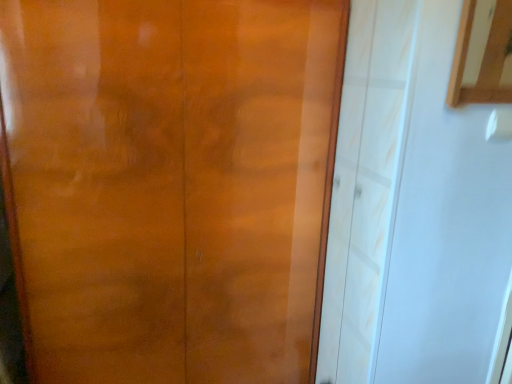
Question: Is matte wood door at center wider than light wood cabinet at upper right?

Choices:
 (A) yes
 (B) no

Answer: (A)

Question: Does matte wood door at center have a greater height compared to light wood cabinet at upper right?

Choices:
 (A) yes
 (B) no

Answer: (A)

Question: Is matte wood door at center oriented towards light wood cabinet at upper right?

Choices:
 (A) yes
 (B) no

Answer: (B)

Question: Are matte wood door at center and light wood cabinet at upper right far apart?

Choices:
 (A) no
 (B) yes

Answer: (B)

Question: Is light wood cabinet at upper right at the back of matte wood door at center?

Choices:
 (A) yes
 (B) no

Answer: (B)

Question: Can you confirm if matte wood door at center is smaller than light wood cabinet at upper right?

Choices:
 (A) yes
 (B) no

Answer: (B)

Question: Is light wood cabinet at upper right smaller than matte wood door at center?

Choices:
 (A) yes
 (B) no

Answer: (A)

Question: Does light wood cabinet at upper right have a greater height compared to matte wood door at center?

Choices:
 (A) no
 (B) yes

Answer: (A)

Question: Can you confirm if light wood cabinet at upper right is positioned to the right of matte wood door at center?

Choices:
 (A) yes
 (B) no

Answer: (A)

Question: Is light wood cabinet at upper right surrounding matte wood door at center?

Choices:
 (A) no
 (B) yes

Answer: (A)

Question: Can you confirm if light wood cabinet at upper right is thinner than matte wood door at center?

Choices:
 (A) yes
 (B) no

Answer: (A)

Question: From a real-world perspective, does light wood cabinet at upper right sit lower than matte wood door at center?

Choices:
 (A) no
 (B) yes

Answer: (A)

Question: From their relative heights in the image, would you say matte wood door at center is taller or shorter than light wood cabinet at upper right?

Choices:
 (A) tall
 (B) short

Answer: (A)